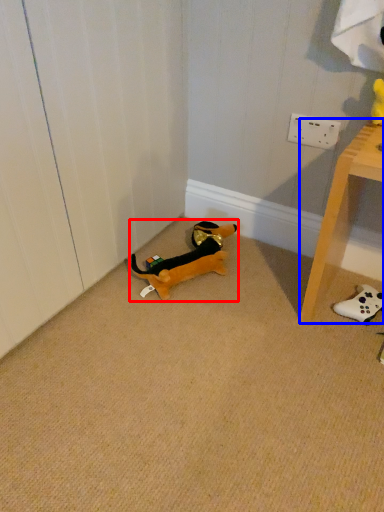
Question: Which object appears closest to the camera in this image, toy (highlighted by a red box) or furniture (highlighted by a blue box)?

Choices:
 (A) toy
 (B) furniture

Answer: (B)